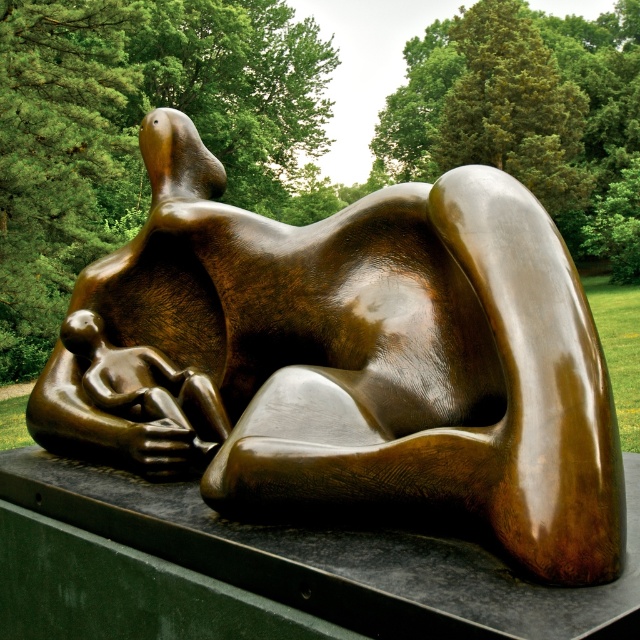
You are a visitor in the park and want to take a photo of the bronze sculpture at center and the matte bronze baby at lower left together in the frame. Based on their positions, which object should you focus on first to ensure both are in the shot?

The bronze sculpture at center is positioned on the right side of matte bronze baby at lower left. To capture both in the frame, focus on the matte bronze baby at lower left first as it is on the left, then adjust the camera to include the bronze sculpture at center on the right side.